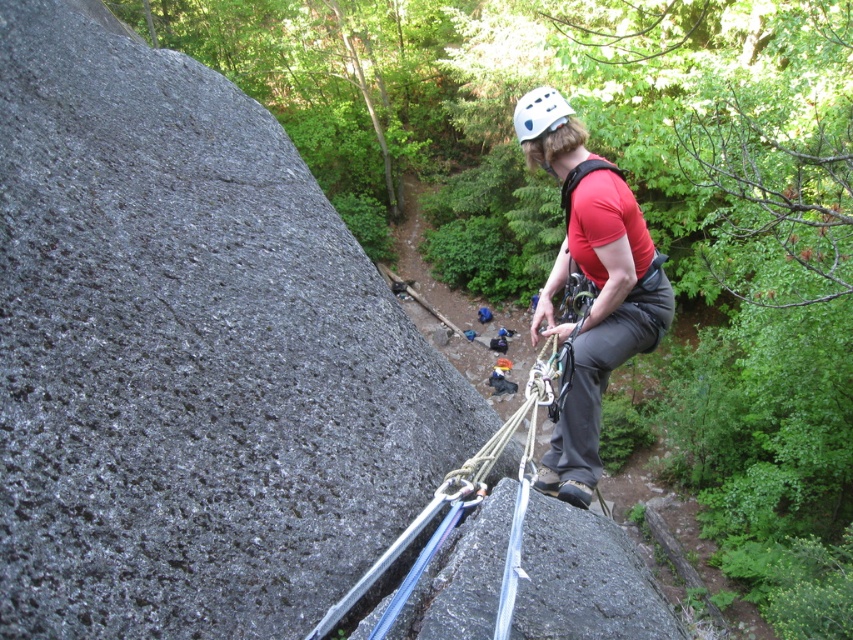
You are a safety inspector assessing the climbing setup. The smooth granite rock at center and the matte red shirt at center are both visible in your line of sight. Which object appears taller from your perspective?

The smooth granite rock at center is taller than the matte red shirt at center, so it appears taller from your perspective.

You are a safety inspector assessing the climbing setup. The smooth granite rock at center is where the climber is anchored. Considering the white matte helmet at upper center, which object is wider?

The smooth granite rock at center is wider than the white matte helmet at upper center according to the description.

While observing the rock climber, you notice two objects in the scene. Which object is taller between the smooth granite rock at center and the white matte helmet at upper center?

The smooth granite rock at center is taller than the white matte helmet at upper center according to the description.